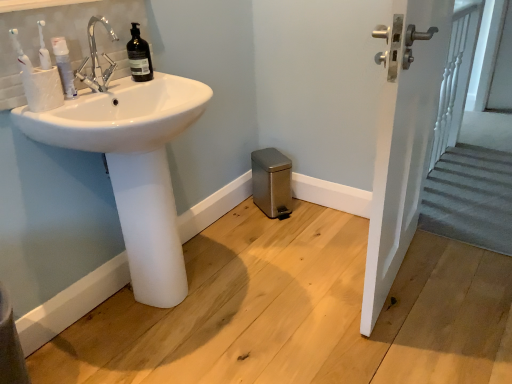
This screenshot has width=512, height=384. In order to click on free space between satin silver trash can at lower center and white glossy sink at left in this screenshot , I will do `click(241, 233)`.